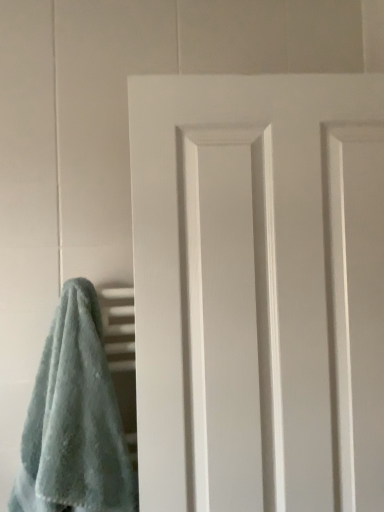
This screenshot has height=512, width=384. In order to click on soft blue towel at lower left in this screenshot , I will do `click(74, 419)`.

What do you see at coordinates (74, 419) in the screenshot?
I see `soft blue towel at lower left` at bounding box center [74, 419].

Describe the element at coordinates (258, 291) in the screenshot. I see `white matte door at center` at that location.

Find the location of `white matte door at center`. white matte door at center is located at coordinates (258, 291).

This screenshot has width=384, height=512. Identify the location of soft blue towel at lower left. (x=74, y=419).

Would you say soft blue towel at lower left is to the left or to the right of white matte door at center in the picture?

From the image, it's evident that soft blue towel at lower left is to the left of white matte door at center.

Is the position of soft blue towel at lower left less distant than that of white matte door at center?

Yes, the depth of soft blue towel at lower left is less than that of white matte door at center.

Does point (48, 375) lie behind point (336, 375)?

That is True.

From the image's perspective, which one is positioned higher, soft blue towel at lower left or white matte door at center?

From the image's view, white matte door at center is above.

From a real-world perspective, between soft blue towel at lower left and white matte door at center, who is vertically higher?

white matte door at center.

Considering the sizes of soft blue towel at lower left and white matte door at center in the image, is soft blue towel at lower left wider or thinner than white matte door at center?

Clearly, soft blue towel at lower left has more width compared to white matte door at center.

Who is shorter, soft blue towel at lower left or white matte door at center?

soft blue towel at lower left is shorter.

Looking at the image, does soft blue towel at lower left seem bigger or smaller compared to white matte door at center?

Considering their sizes, soft blue towel at lower left takes up less space than white matte door at center.

Would you say white matte door at center is part of soft blue towel at lower left's contents?

No, white matte door at center is located outside of soft blue towel at lower left.

Looking at this image, is soft blue towel at lower left in contact with white matte door at center?

No.

From the picture: Is soft blue towel at lower left facing towards white matte door at center?

No, soft blue towel at lower left is not turned towards white matte door at center.

Can you tell me how much soft blue towel at lower left and white matte door at center differ in facing direction?

The angle between the facing direction of soft blue towel at lower left and the facing direction of white matte door at center is 10 degrees.

How much distance is there between soft blue towel at lower left and white matte door at center?

10.68 inches.

At what (x,y) coordinates should I click in order to perform the action: click on towel on the left side of white matte door at center. Please return your answer as a coordinate pair (x, y). The width and height of the screenshot is (384, 512). Looking at the image, I should click on (74, 419).

Which is more to the right, white matte door at center or soft blue towel at lower left?

white matte door at center is more to the right.

Based on the photo, which object is closer to the camera, white matte door at center or soft blue towel at lower left?

soft blue towel at lower left is closer to the camera.

Which is in front, point (365, 462) or point (13, 494)?

Point (365, 462)

From the image's perspective, which is below, white matte door at center or soft blue towel at lower left?

soft blue towel at lower left.

Based on the photo, from a real-world perspective, relative to soft blue towel at lower left, is white matte door at center vertically above or below?

white matte door at center is situated higher than soft blue towel at lower left in the real world.

Considering the relative sizes of white matte door at center and soft blue towel at lower left in the image provided, is white matte door at center wider than soft blue towel at lower left?

Incorrect, the width of white matte door at center does not surpass that of soft blue towel at lower left.

Considering the sizes of objects white matte door at center and soft blue towel at lower left in the image provided, who is shorter, white matte door at center or soft blue towel at lower left?

With less height is soft blue towel at lower left.

Based on their sizes in the image, would you say white matte door at center is bigger or smaller than soft blue towel at lower left?

Clearly, white matte door at center is larger in size than soft blue towel at lower left.

Is white matte door at center outside of soft blue towel at lower left?

Indeed, white matte door at center is completely outside soft blue towel at lower left.

Would you say white matte door at center is a long distance from soft blue towel at lower left?

No, white matte door at center is not far from soft blue towel at lower left.

Could you tell me if white matte door at center is turned towards soft blue towel at lower left?

No, white matte door at center is not aimed at soft blue towel at lower left.

Find the location of a particular element. The width and height of the screenshot is (384, 512). towel on the left of white matte door at center is located at coordinates (74, 419).

Where is `door lying behind the soft blue towel at lower left`? The image size is (384, 512). door lying behind the soft blue towel at lower left is located at coordinates click(x=258, y=291).

The image size is (384, 512). Identify the location of towel below the white matte door at center (from the image's perspective). (74, 419).